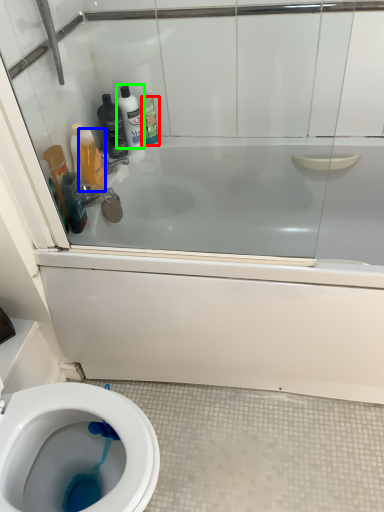
Question: Based on their relative distances, which object is farther from cleaning product (highlighted by a red box)? Choose from cleaning product (highlighted by a blue box) and cleaning product (highlighted by a green box).

Choices:
 (A) cleaning product
 (B) cleaning product

Answer: (A)